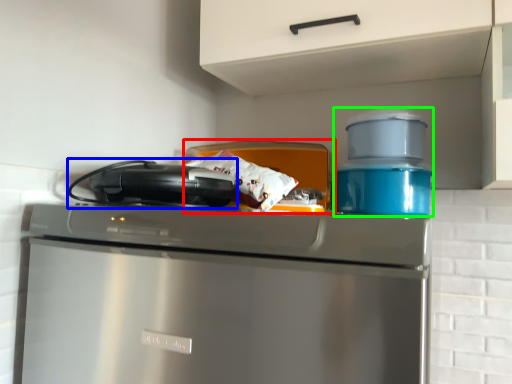
Question: Estimate the real-world distances between objects in this image. Which object is farther from appliance (highlighted by a red box), kitchen appliance (highlighted by a blue box) or appliance (highlighted by a green box)?

Choices:
 (A) kitchen appliance
 (B) appliance

Answer: (A)